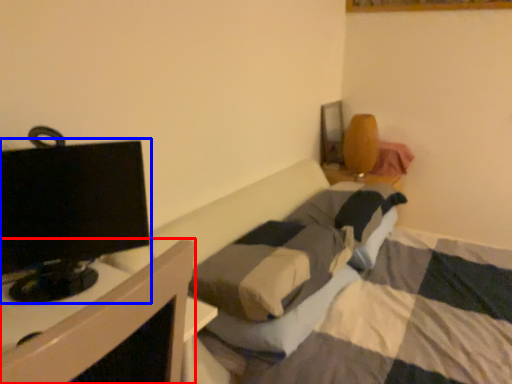
Question: Which of the following is the farthest to the observer, furniture (highlighted by a red box) or television (highlighted by a blue box)?

Choices:
 (A) furniture
 (B) television

Answer: (B)